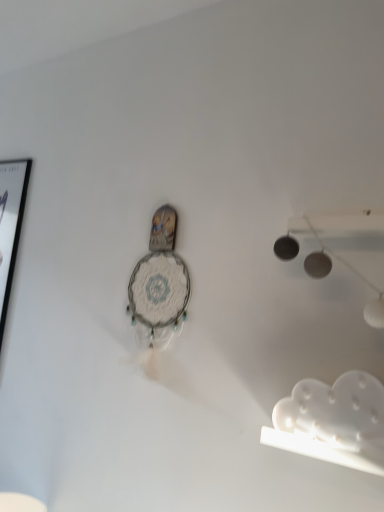
This screenshot has width=384, height=512. What do you see at coordinates (10, 225) in the screenshot?
I see `black glossy picture frame at left` at bounding box center [10, 225].

What is the approximate width of white matte cloud at lower right?

white matte cloud at lower right is 1.74 inches wide.

Measure the distance between white matte cloud at lower right and camera.

87.40 centimeters.

Image resolution: width=384 pixels, height=512 pixels. Describe the element at coordinates (159, 279) in the screenshot. I see `white lace clock at center` at that location.

What is the approximate width of white lace clock at center?

white lace clock at center is 1.99 inches in width.

Find the location of a particular element. The height and width of the screenshot is (512, 384). black glossy picture frame at left is located at coordinates (10, 225).

Based on the photo, considering the relative sizes of white matte cloud at lower right and black glossy picture frame at left in the image provided, is white matte cloud at lower right taller than black glossy picture frame at left?

In fact, white matte cloud at lower right may be shorter than black glossy picture frame at left.

In terms of width, does white matte cloud at lower right look wider or thinner when compared to black glossy picture frame at left?

Clearly, white matte cloud at lower right has less width compared to black glossy picture frame at left.

Can we say white matte cloud at lower right lies outside black glossy picture frame at left?

Yes.

How distant is black glossy picture frame at left from white matte cloud at lower right?

A: 1.36 meters.

I want to click on picture frame above the white matte cloud at lower right (from a real-world perspective), so click(x=10, y=225).

Would you say white matte cloud at lower right is part of black glossy picture frame at left's contents?

No, white matte cloud at lower right is not a part of black glossy picture frame at left.

Is the surface of black glossy picture frame at left in direct contact with white matte cloud at lower right?

black glossy picture frame at left and white matte cloud at lower right are clearly separated.

In the scene shown: Does white matte cloud at lower right contain white lace clock at center?

No, white lace clock at center is not a part of white matte cloud at lower right.

From a real-world perspective, between white matte cloud at lower right and white lace clock at center, who is vertically lower?

white matte cloud at lower right, from a real-world perspective.

Is white matte cloud at lower right to the right of white lace clock at center from the viewer's perspective?

Correct, you'll find white matte cloud at lower right to the right of white lace clock at center.

Looking at this image, is black glossy picture frame at left wider or thinner than white lace clock at center?

Clearly, black glossy picture frame at left has more width compared to white lace clock at center.

Can you confirm if black glossy picture frame at left is positioned to the left of white lace clock at center?

Yes, black glossy picture frame at left is to the left of white lace clock at center.

I want to click on picture frame lying above the white lace clock at center (from the image's perspective), so click(x=10, y=225).

Does point (12, 275) come farther from viewer compared to point (130, 290)?

Yes.

Which is more to the left, white lace clock at center or white matte cloud at lower right?

white lace clock at center is more to the left.

Do you think white lace clock at center is within white matte cloud at lower right, or outside of it?

white lace clock at center is located beyond the bounds of white matte cloud at lower right.

Does point (155, 248) appear closer or farther from the camera than point (322, 417)?

Point (155, 248) appears to be farther away from the viewer than point (322, 417).

Is white lace clock at center not near white matte cloud at lower right?

No, there isn't a large distance between white lace clock at center and white matte cloud at lower right.

Is white lace clock at center touching black glossy picture frame at left?

There is a gap between white lace clock at center and black glossy picture frame at left.

Is black glossy picture frame at left inside white lace clock at center?

No, black glossy picture frame at left is not inside white lace clock at center.

Considering their positions, is white lace clock at center located in front of or behind black glossy picture frame at left?

Visually, white lace clock at center is located in front of black glossy picture frame at left.

Which is nearer, (148, 297) or (9, 296)?

The point (148, 297) is more forward.

I want to click on picture frame behind the white matte cloud at lower right, so click(10, 225).

At what (x,y) coordinates should I click in order to perform the action: click on lamp lying on the right of black glossy picture frame at left. Please return your answer as a coordinate pair (x, y). This screenshot has width=384, height=512. Looking at the image, I should click on (333, 421).

Looking at the image, which one is located closer to black glossy picture frame at left, white matte cloud at lower right or white lace clock at center?

white lace clock at center is closer to black glossy picture frame at left.

From the picture: When comparing their distances from white lace clock at center, does black glossy picture frame at left or white matte cloud at lower right seem closer?

Based on the image, white matte cloud at lower right appears to be nearer to white lace clock at center.

From the picture: Considering their positions, is white matte cloud at lower right positioned further to white lace clock at center than black glossy picture frame at left?

black glossy picture frame at left is positioned further to the anchor white lace clock at center.

Considering their positions, is black glossy picture frame at left positioned further to white matte cloud at lower right than white lace clock at center?

Based on the image, black glossy picture frame at left appears to be further to white matte cloud at lower right.

Estimate the real-world distances between objects in this image. Which object is closer to white matte cloud at lower right, white lace clock at center or black glossy picture frame at left?

The object closer to white matte cloud at lower right is white lace clock at center.

Which object lies nearer to the anchor point black glossy picture frame at left, white lace clock at center or white matte cloud at lower right?

white lace clock at center is positioned closer to the anchor black glossy picture frame at left.

Find the location of a particular element. The image size is (384, 512). clock between black glossy picture frame at left and white matte cloud at lower right in the horizontal direction is located at coordinates (159, 279).